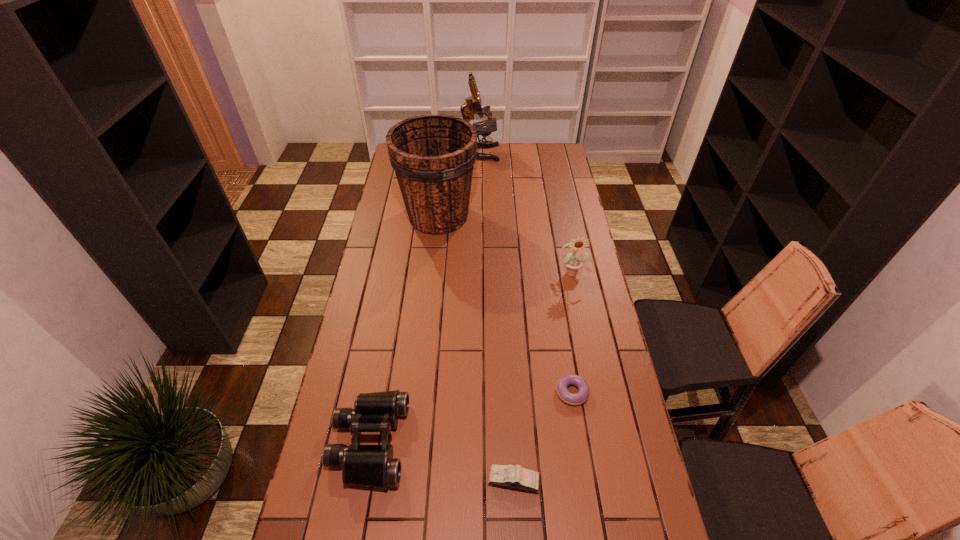
Where is `the farthest object`? the farthest object is located at coordinates (473, 105).

The width and height of the screenshot is (960, 540). In order to click on bucket in this screenshot , I will do `click(433, 156)`.

Where is `the third tallest object`? Image resolution: width=960 pixels, height=540 pixels. the third tallest object is located at coordinates (573, 264).

Identify the location of the fourth nearest object. Image resolution: width=960 pixels, height=540 pixels. (573, 264).

Locate an element on the screen. binoculars is located at coordinates coord(373,466).

You are a GUI agent. You are given a task and a screenshot of the screen. Output one action in this format:
    pyautogui.click(x=<x>, y=<y>)
    Task: Click on the diary
    Image resolution: width=960 pixels, height=540 pixels.
    Given the screenshot: What is the action you would take?
    pyautogui.click(x=511, y=476)

This screenshot has width=960, height=540. I want to click on doughnut, so click(581, 396).

You are a GUI agent. You are given a task and a screenshot of the screen. Output one action in this format:
    pyautogui.click(x=<x>, y=<y>)
    Task: Click on the blank area located 0.230m at the eyepieces of the microscope
    The height and width of the screenshot is (540, 960).
    Given the screenshot: What is the action you would take?
    tap(542, 152)

Locate an element on the screen. Image resolution: width=960 pixels, height=540 pixels. vacant space situated on the right of the bucket is located at coordinates (489, 216).

The height and width of the screenshot is (540, 960). I want to click on vacant space located on the front-facing side of the fourth shortest object, so click(588, 345).